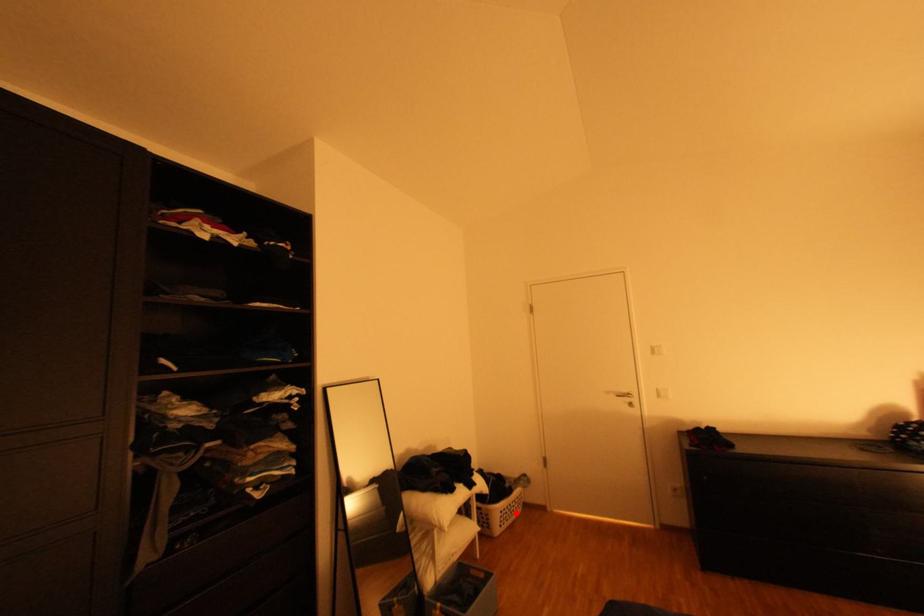
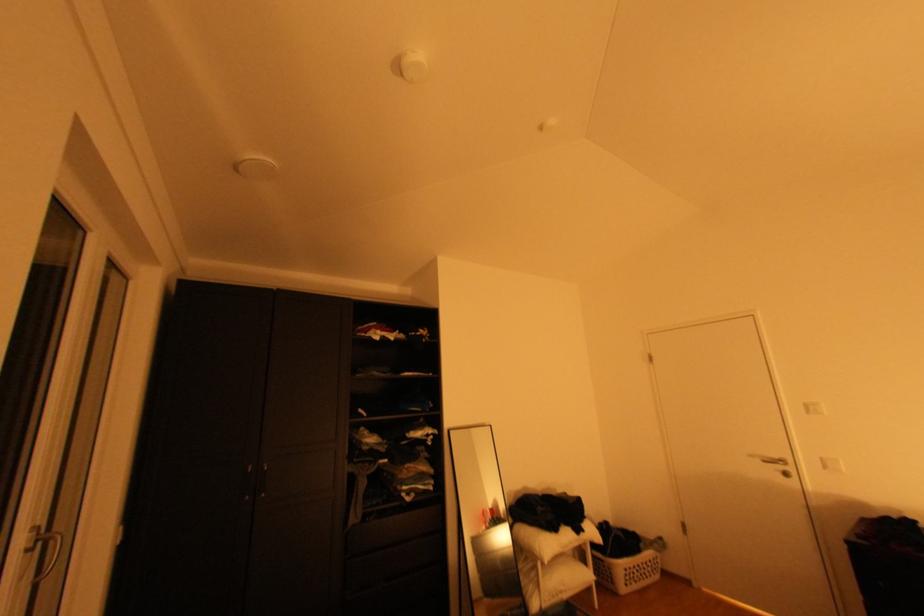
Question: I am providing you with two images of the same scene from different viewpoints. Image1 has a red point marked. In image2, the corresponding 3D location appears at what relative position? Reply with the corresponding letter.

Choices:
 (A) Closer
 (B) Farther

Answer: (A)